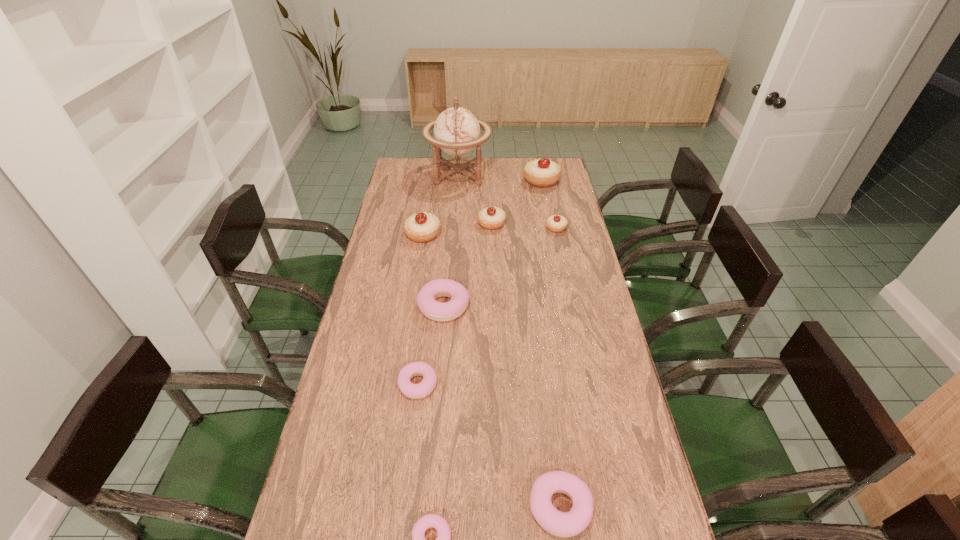
Select which pink pastry appears as the closest to the smallest pink pastry. Please provide its 2D coordinates. Your answer should be formatted as a tuple, i.e. [(x, y)], where the tuple contains the x and y coordinates of a point satisfying the conditions above.

[(562, 524)]